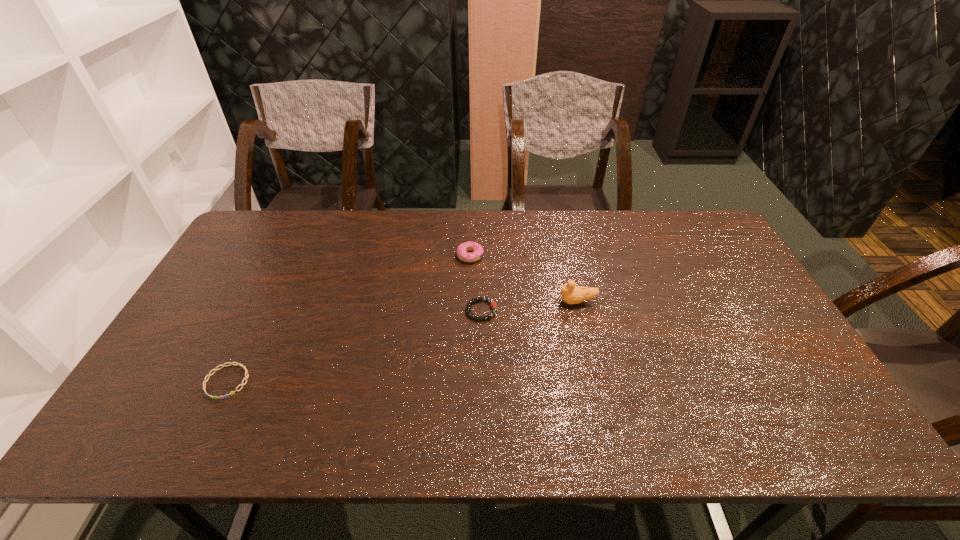
Where is `free space located on the back of the farthest object`? The height and width of the screenshot is (540, 960). free space located on the back of the farthest object is located at coordinates (471, 218).

The height and width of the screenshot is (540, 960). Find the location of `free spot located 0.350m on the front of the farther bracelet`. free spot located 0.350m on the front of the farther bracelet is located at coordinates (482, 441).

What are the coordinates of `vacant space located 0.110m on the surface of the leftmost object showing star-shaped elements` in the screenshot? It's located at (197, 444).

Where is `object positioned at the far edge`? object positioned at the far edge is located at coordinates (462, 250).

What are the coordinates of `object that is at the left edge` in the screenshot? It's located at (237, 364).

This screenshot has width=960, height=540. Identify the location of vacant area at the far edge of the desktop. (573, 251).

In the image, there is a desktop. At what (x,y) coordinates should I click in order to perform the action: click on blank space at the near edge. Please return your answer as a coordinate pair (x, y). This screenshot has width=960, height=540. Looking at the image, I should click on (498, 429).

Find the location of a particular element. vacant region at the left edge of the desktop is located at coordinates pyautogui.click(x=224, y=275).

You are a GUI agent. You are given a task and a screenshot of the screen. Output one action in this format:
    pyautogui.click(x=<x>, y=<y>)
    Task: Click on the vacant space at the right edge of the desktop
    
    Given the screenshot: What is the action you would take?
    pyautogui.click(x=728, y=295)

The width and height of the screenshot is (960, 540). In order to click on blank space at the far left corner in this screenshot , I will do `click(274, 213)`.